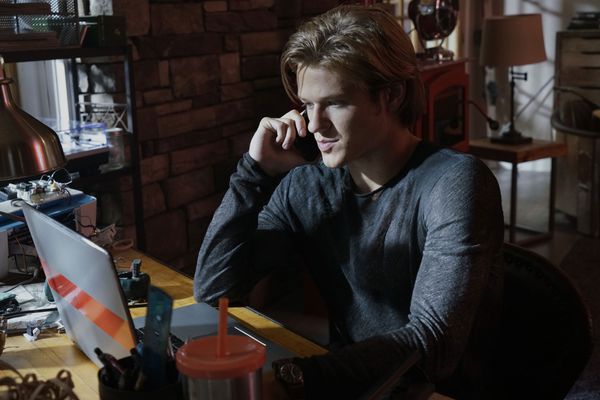
Find the location of a particular element. This screenshot has height=400, width=600. fan is located at coordinates (442, 27).